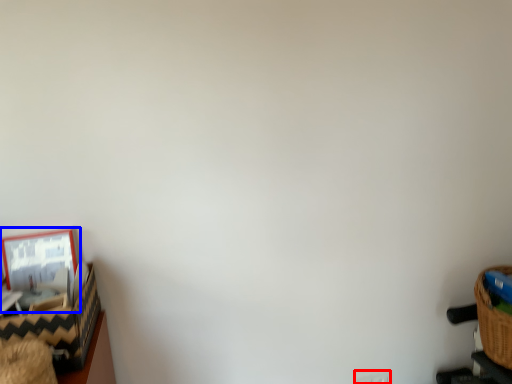
Question: Which of the following is the closest to the observer, electric outlet (highlighted by a red box) or picture frame (highlighted by a blue box)?

Choices:
 (A) electric outlet
 (B) picture frame

Answer: (B)